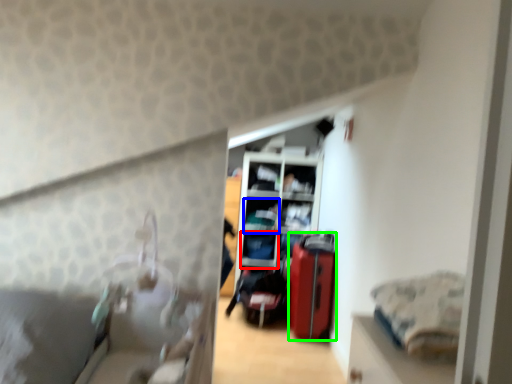
Question: Based on their relative distances, which object is nearer to shelf (highlighted by a red box)? Choose from shelf (highlighted by a blue box) and luggage (highlighted by a green box).

Choices:
 (A) shelf
 (B) luggage

Answer: (A)